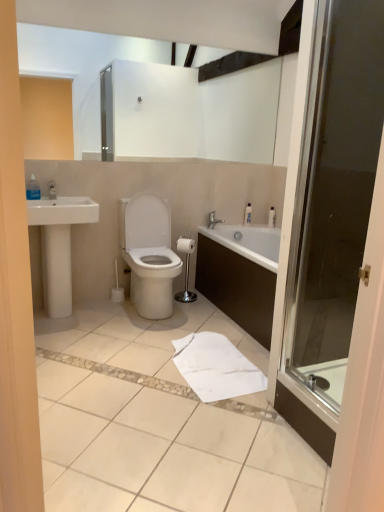
Question: Is transparent plastic bottle at upper left, the third toiletry viewed from the right, completely or partially inside white paper towel at lower center?

Choices:
 (A) no
 (B) yes

Answer: (A)

Question: Would you consider white paper towel at lower center to be distant from transparent plastic bottle at upper left, the third toiletry viewed from the right?

Choices:
 (A) no
 (B) yes

Answer: (B)

Question: Is white paper towel at lower center at the right side of transparent plastic bottle at upper left, marked as the 1th toiletry in a left-to-right arrangement?

Choices:
 (A) yes
 (B) no

Answer: (A)

Question: Can you confirm if white paper towel at lower center is positioned to the left of transparent plastic bottle at upper left, which appears as the 3th toiletry when viewed from the back?

Choices:
 (A) no
 (B) yes

Answer: (A)

Question: Are white paper towel at lower center and transparent plastic bottle at upper left, marked as the 1th toiletry in a left-to-right arrangement, making contact?

Choices:
 (A) yes
 (B) no

Answer: (B)

Question: Is white ceramic sink at left wider or thinner than silver metallic faucet at upper center?

Choices:
 (A) thin
 (B) wide

Answer: (B)

Question: Considering the positions of white ceramic sink at left and silver metallic faucet at upper center in the image, is white ceramic sink at left taller or shorter than silver metallic faucet at upper center?

Choices:
 (A) tall
 (B) short

Answer: (A)

Question: From a real-world perspective, relative to silver metallic faucet at upper center, is white ceramic sink at left vertically above or below?

Choices:
 (A) above
 (B) below

Answer: (B)

Question: Relative to silver metallic faucet at upper center, is white ceramic sink at left in front or behind?

Choices:
 (A) front
 (B) behind

Answer: (A)

Question: Considering the positions of transparent plastic bottle at upper left, the first toiletry viewed from the front, and transparent glass shower door at right in the image, is transparent plastic bottle at upper left, the first toiletry viewed from the front, taller or shorter than transparent glass shower door at right?

Choices:
 (A) tall
 (B) short

Answer: (B)

Question: Considering the relative positions of transparent plastic bottle at upper left, the third toiletry viewed from the right, and transparent glass shower door at right in the image provided, is transparent plastic bottle at upper left, the third toiletry viewed from the right, to the left or to the right of transparent glass shower door at right?

Choices:
 (A) left
 (B) right

Answer: (A)

Question: Considering their positions, is transparent plastic bottle at upper left, marked as the 1th toiletry in a left-to-right arrangement, located in front of or behind transparent glass shower door at right?

Choices:
 (A) behind
 (B) front

Answer: (A)

Question: Would you say transparent plastic bottle at upper left, which appears as the 3th toiletry when viewed from the back, is inside or outside transparent glass shower door at right?

Choices:
 (A) inside
 (B) outside

Answer: (B)

Question: From their relative heights in the image, would you say white plastic bottle at upper right, placed as the 2th toiletry when sorted from left to right, is taller or shorter than transparent glass shower door at right?

Choices:
 (A) short
 (B) tall

Answer: (A)

Question: From the image's perspective, relative to transparent glass shower door at right, is white plastic bottle at upper right, positioned as the second toiletry in front-to-back order, above or below?

Choices:
 (A) above
 (B) below

Answer: (A)